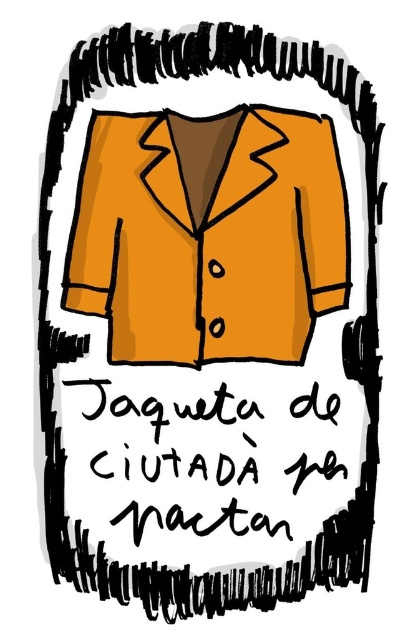
Question: Which point is farther to the camera?

Choices:
 (A) orange matte jacket at center
 (B) black handwritten text at center

Answer: (B)

Question: Is the position of orange matte jacket at center less distant than that of black handwritten text at center?

Choices:
 (A) no
 (B) yes

Answer: (B)

Question: Among these objects, which one is farthest from the camera?

Choices:
 (A) orange matte jacket at center
 (B) black handwritten text at center

Answer: (B)

Question: Is the position of orange matte jacket at center more distant than that of black handwritten text at center?

Choices:
 (A) no
 (B) yes

Answer: (A)

Question: Can you confirm if orange matte jacket at center is positioned below black handwritten text at center?

Choices:
 (A) no
 (B) yes

Answer: (A)

Question: Which point is closer to the camera?

Choices:
 (A) orange matte jacket at center
 (B) black handwritten text at center

Answer: (A)